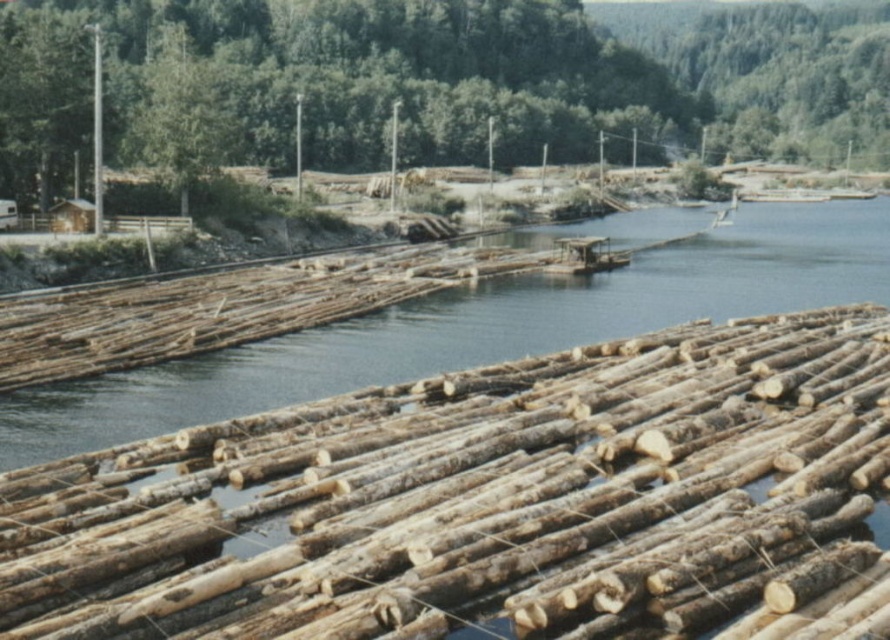
Is natural wood river at center positioned behind green leafy tree at upper left?

No, it is in front of green leafy tree at upper left.

Between point (758, 298) and point (144, 147), which one is positioned behind?

Positioned behind is point (144, 147).

Is point (751, 204) farther from viewer compared to point (195, 152)?

Yes.

Where is `natural wood river at center`? Image resolution: width=890 pixels, height=640 pixels. natural wood river at center is located at coordinates (475, 326).

Between natural wood logs at center and natural wood river at center, which one appears on the left side from the viewer's perspective?

natural wood logs at center is more to the left.

Does natural wood logs at center come in front of natural wood river at center?

Yes, it is.

Locate an element on the screen. The image size is (890, 640). natural wood logs at center is located at coordinates (492, 500).

Can you confirm if green leafy tree at upper center is smaller than green leafy tree at upper left?

No, green leafy tree at upper center is not smaller than green leafy tree at upper left.

Can you confirm if green leafy tree at upper center is wider than green leafy tree at upper left?

Yes.

Is point (75, 74) closer to viewer compared to point (192, 170)?

No, (75, 74) is behind (192, 170).

You are a GUI agent. You are given a task and a screenshot of the screen. Output one action in this format:
    pyautogui.click(x=<x>, y=<y>)
    Task: Click on the green leafy tree at upper center
    
    Given the screenshot: What is the action you would take?
    pyautogui.click(x=452, y=81)